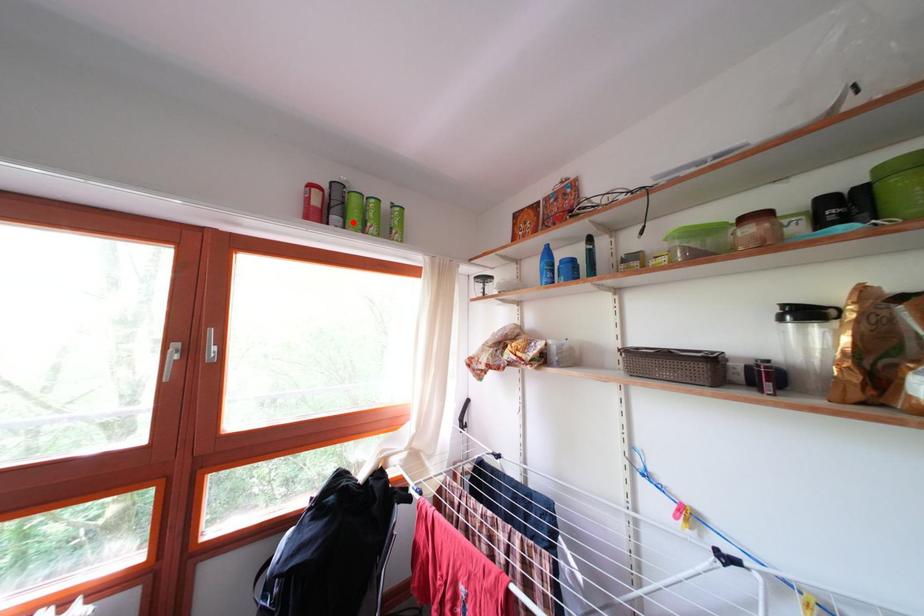
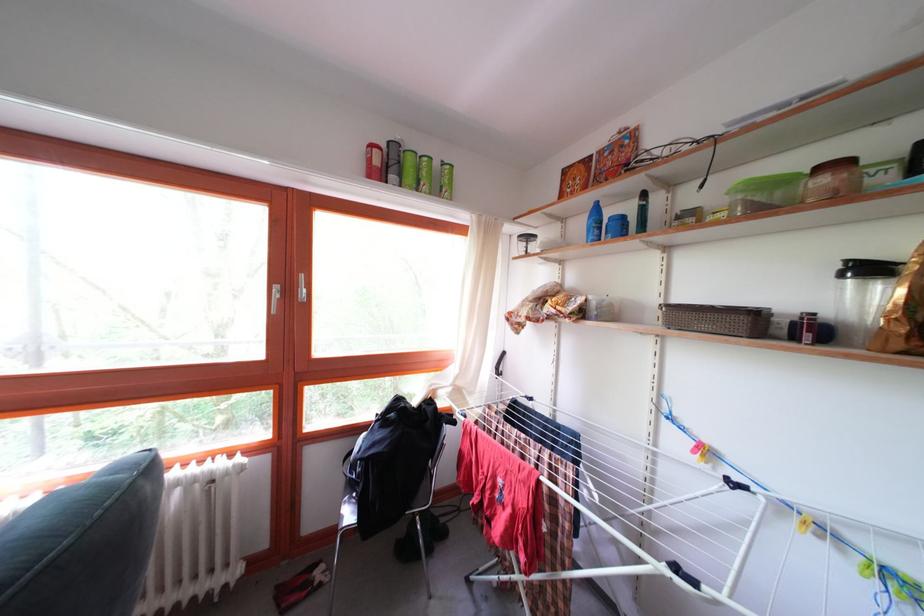
Where in the second image is the point corresponding to the highlighted location from the first image?

(409, 180)